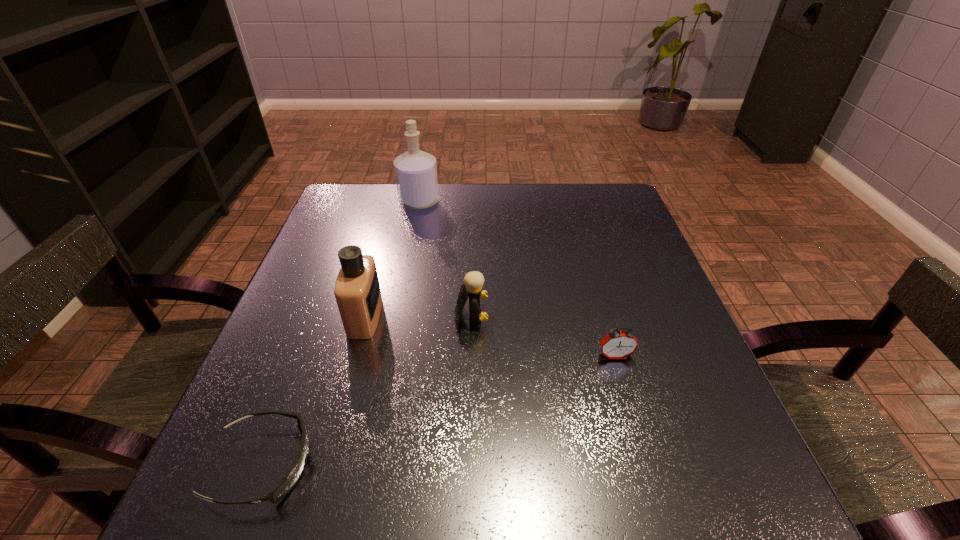
I want to click on free space between the shortest object and the second nearest object, so click(x=439, y=411).

Image resolution: width=960 pixels, height=540 pixels. What are the coordinates of `vacant space that's between the taller perfume and the third tallest object` in the screenshot? It's located at (445, 259).

This screenshot has width=960, height=540. Identify the location of vacant point located between the shorter perfume and the goggles. (314, 391).

This screenshot has height=540, width=960. I want to click on vacant area between the taller perfume and the shortest object, so point(341,333).

This screenshot has height=540, width=960. In order to click on vacant area that lies between the Lego and the shortest object in this screenshot , I will do `click(367, 390)`.

Find the location of `vacant space that is in between the fourth farthest object and the fourth object from left to right`. vacant space that is in between the fourth farthest object and the fourth object from left to right is located at coordinates (543, 336).

Choose which object is the second nearest neighbor to the second tallest object. Please provide its 2D coordinates. Your answer should be formatted as a tuple, i.e. [(x, y)], where the tuple contains the x and y coordinates of a point satisfying the conditions above.

[(293, 475)]

Where is `the fourth closest object to the nearest object`? This screenshot has height=540, width=960. the fourth closest object to the nearest object is located at coordinates (415, 171).

Locate an element on the screen. vacant region that satisfies the following two spatial constraints: 1. on the clock face of the second shortest object; 2. on the lenses of the shortest object is located at coordinates (646, 465).

At what (x,y) coordinates should I click in order to perform the action: click on free location that satisfies the following two spatial constraints: 1. on the front side of the tallest object; 2. on the front label of the nearer perfume. Please return your answer as a coordinate pair (x, y). This screenshot has height=540, width=960. Looking at the image, I should click on (396, 317).